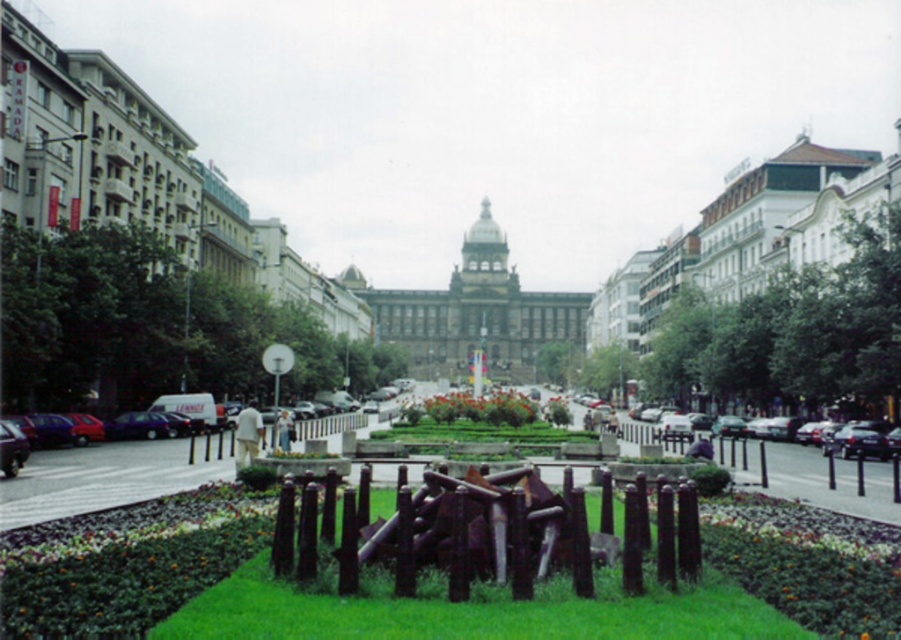
You are standing at the entrance of the grand neoclassical building with a prominent dome and columns. You want to walk to the green grass at center. Which direction should you head towards?

The green grass at center is located at point coordinates relative to the image, so you should head towards the center of the street from the building entrance to reach it.

You are a delivery person with a 2.5 meter wide delivery truck. You need to drive from the street to the grand neoclassical building at the end. There is a dark brown wooden fence at center and a black metal fence at lower right in your way. Can your truck fit through the space between them?

The dark brown wooden fence at center is 28.31 meters from the black metal fence at lower right. Since the truck is only 2.5 meters wide, it can easily fit through the space between them as the distance between the fences is much wider than the truck.

You are standing on the urban street scene and want to walk towards the grand neoclassical building with a dome. Which point, point (567, 518) or point (779, 444), is closer to you as you start walking?

Point (567, 518) is closer to the viewer than point (779, 444), so it is closer as you start walking.